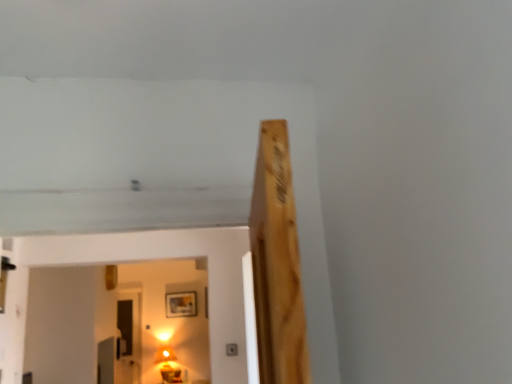
Question: Is point (188, 312) closer or farther from the camera than point (131, 357)?

Choices:
 (A) closer
 (B) farther

Answer: (B)

Question: From a real-world perspective, is wooden picture frame at upper center above or below transparent glass door at lower left?

Choices:
 (A) above
 (B) below

Answer: (A)

Question: Which object is the closest to the wooden picture frame at upper center?

Choices:
 (A) transparent glass door at lower left
 (B) matte gold lamp at lower center

Answer: (B)

Question: Estimate the real-world distances between objects in this image. Which object is farther from the wooden picture frame at upper center?

Choices:
 (A) matte gold lamp at lower center
 (B) transparent glass door at lower left

Answer: (B)